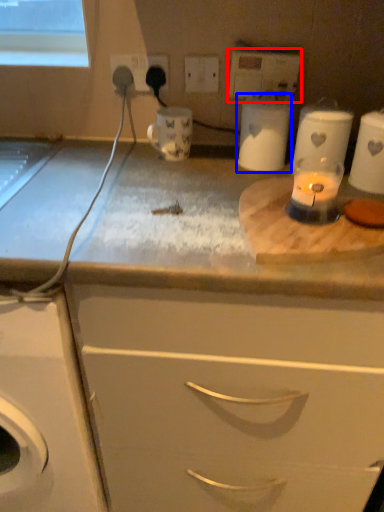
Question: Which point is closer to the camera, electric outlet (highlighted by a red box) or appliance (highlighted by a blue box)?

Choices:
 (A) electric outlet
 (B) appliance

Answer: (B)